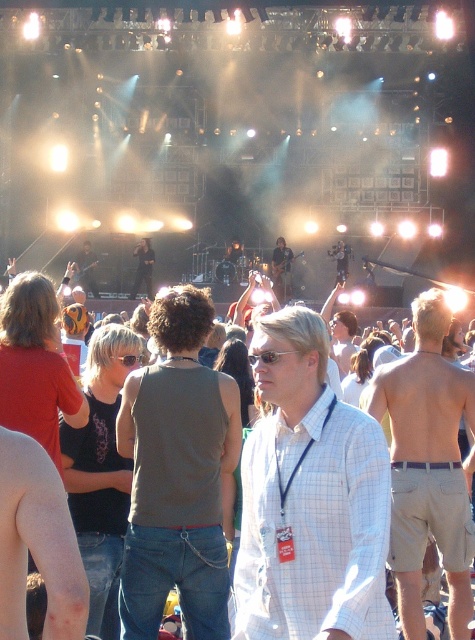
You are a photographer trying to capture a photo of the shiny black guitar at center without the dark gray tank top at center blocking it. Based on their relative heights, which object should you focus on to ensure the guitar is visible?

The dark gray tank top at center has a greater height compared to the shiny black guitar at center, so you should position yourself to focus on the shiny black guitar at center at a lower angle to avoid the obstruction from the taller tank top.

You are standing at the concert and want to take a photo of both the crowd and the stage. You notice two points in the image labeled as point (417,346) and point (284,243). Which point is closer to you?

Point (417,346) is closer to the camera than point (284,243).

You are a photographer trying to capture a clear shot of both the tan shorts at center and the shiny black guitar at center in the concert image. Which object should you focus on first to ensure it appears sharp in the photo?

The tan shorts at center is larger in size than the shiny black guitar at center, so you should focus on the tan shorts at center first to ensure it appears sharp in the photo.